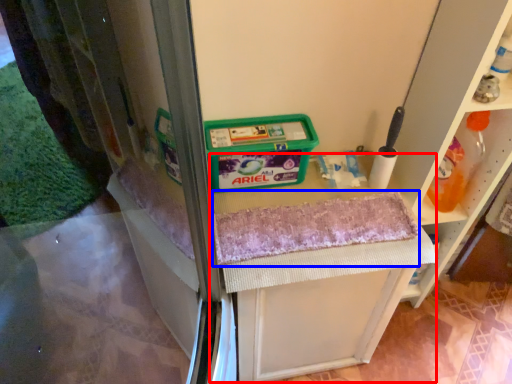
Question: Which object is closer to the camera taking this photo, vanity (highlighted by a red box) or bath towel (highlighted by a blue box)?

Choices:
 (A) vanity
 (B) bath towel

Answer: (B)